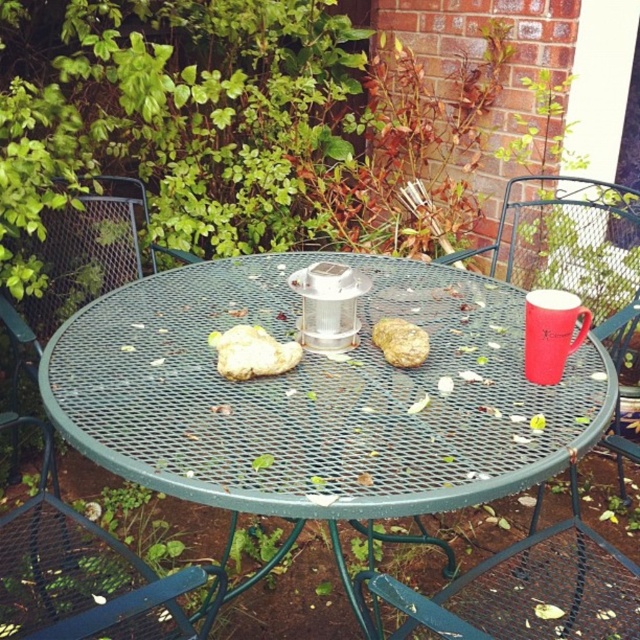
Question: Which point is closer to the camera?

Choices:
 (A) (538, 381)
 (B) (396, 336)
 (C) (344, 253)

Answer: (A)

Question: Which object is closer to the camera taking this photo?

Choices:
 (A) green mesh table at center
 (B) red matte mug at right

Answer: (A)

Question: Based on their relative distances, which object is farther from the green mesh table at center?

Choices:
 (A) metal mesh chair at right
 (B) brown crumbly bread at center
 (C) white crumbly bread at center
 (D) green metal chair at lower left

Answer: (A)

Question: Is the position of metal mesh chair at right less distant than that of green metal chair at lower left?

Choices:
 (A) yes
 (B) no

Answer: (B)

Question: Is red matte mug at right smaller than white crumbly bread at center?

Choices:
 (A) no
 (B) yes

Answer: (A)

Question: Does green mesh table at center appear on the left side of white crumbly bread at center?

Choices:
 (A) no
 (B) yes

Answer: (A)